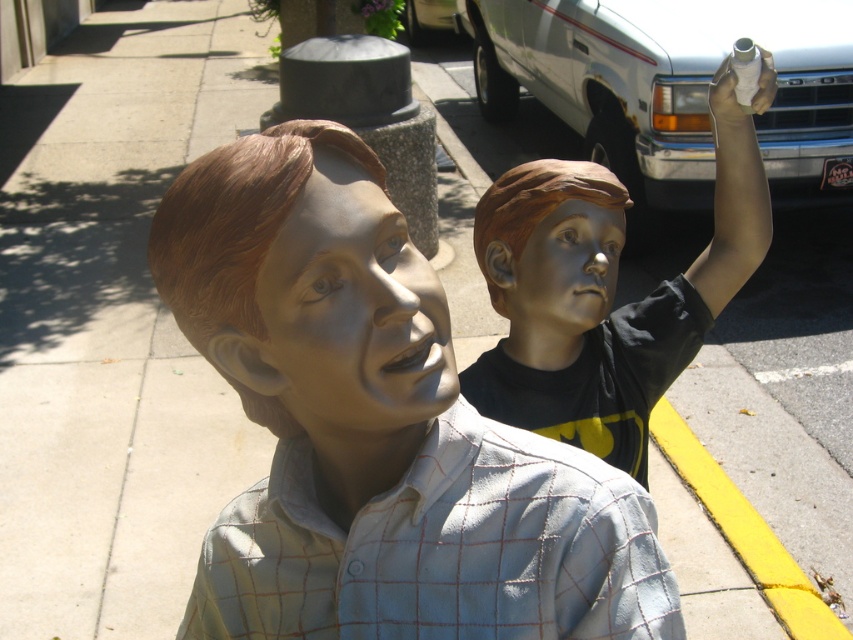
Question: Which object is closer to the camera taking this photo?

Choices:
 (A) smooth silver face at center
 (B) matte bronze statue at right
 (C) white matte hand at upper right

Answer: (A)

Question: Does smooth silver face at center have a greater width compared to blue metallic face at center?

Choices:
 (A) no
 (B) yes

Answer: (A)

Question: Estimate the real-world distances between objects in this image. Which object is closer to the blue metallic face at center?

Choices:
 (A) matte silver head at center
 (B) satin gold head at upper right

Answer: (B)

Question: Which object is positioned closest to the matte bronze statue at right?

Choices:
 (A) matte silver head at center
 (B) smooth silver face at center
 (C) satin gold head at upper right
 (D) blue metallic face at center

Answer: (D)

Question: Does matte silver head at center have a larger size compared to satin gold head at upper right?

Choices:
 (A) no
 (B) yes

Answer: (B)

Question: Is matte silver head at center positioned before white matte hand at upper right?

Choices:
 (A) no
 (B) yes

Answer: (B)